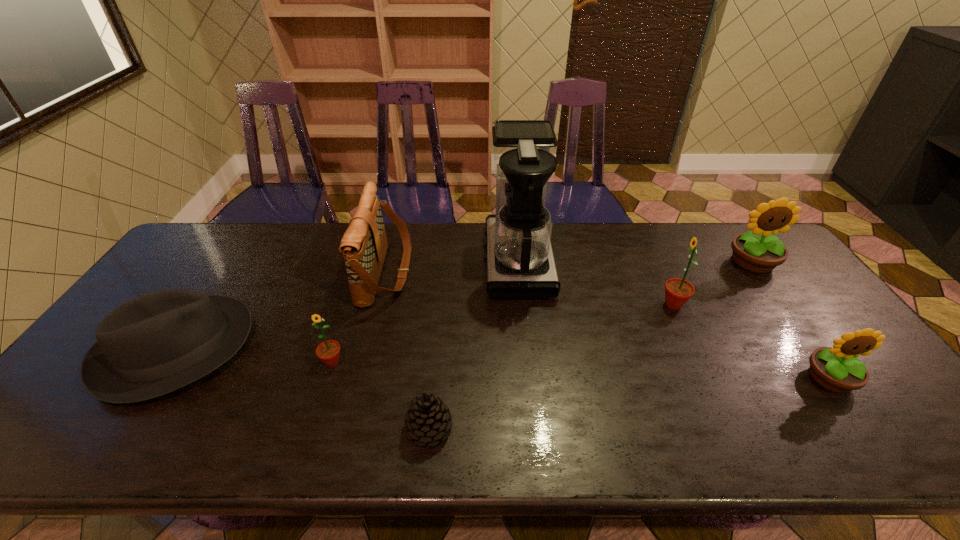
Locate an element on the screen. Image resolution: width=960 pixels, height=540 pixels. vacant point that satisfies the following two spatial constraints: 1. on the face of the farther yellow sunflower; 2. on the front-facing side of the shoulder bag is located at coordinates (759, 272).

The height and width of the screenshot is (540, 960). I want to click on vacant space that satisfies the following two spatial constraints: 1. on the face of the third sunflower from right to left; 2. on the front side of the fedora, so click(x=694, y=349).

Find the location of a particular element. This screenshot has width=960, height=540. vacant space that satisfies the following two spatial constraints: 1. on the front-facing side of the shoulder bag; 2. on the face of the smaller green sunflower is located at coordinates (364, 362).

Locate an element on the screen. This screenshot has height=540, width=960. blank area in the image that satisfies the following two spatial constraints: 1. on the face of the bigger yellow sunflower; 2. on the front-facing side of the shoulder bag is located at coordinates (759, 272).